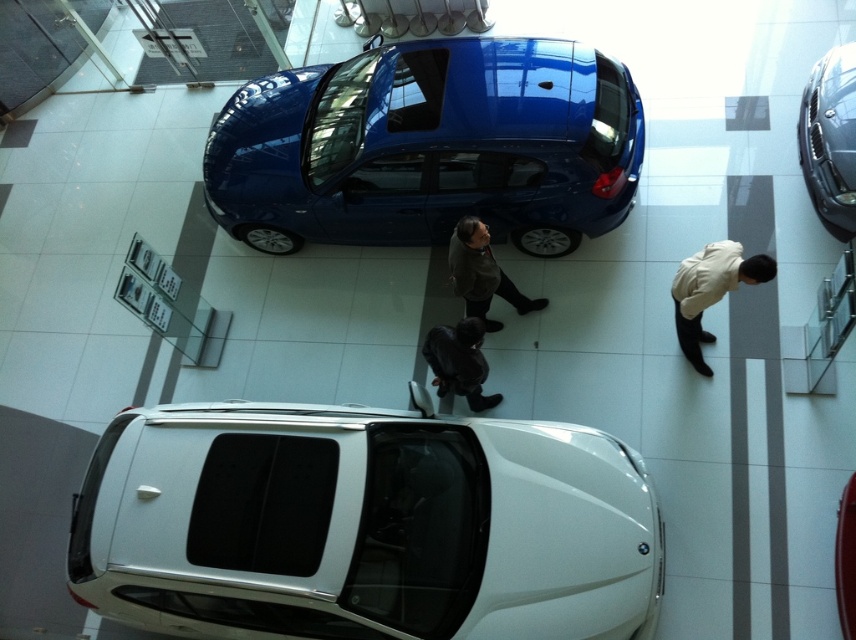
Who is more distant from viewer, (406, 566) or (685, 282)?

The point (685, 282) is behind.

The width and height of the screenshot is (856, 640). Describe the element at coordinates (364, 525) in the screenshot. I see `white glossy suv at lower center` at that location.

Which is in front, point (538, 512) or point (703, 364)?

Point (538, 512) is more forward.

The width and height of the screenshot is (856, 640). Identify the location of white glossy suv at lower center. click(364, 525).

Is white matte jacket at lower right below black leather jacket at center?

No.

Who is positioned more to the left, white matte jacket at lower right or black leather jacket at center?

black leather jacket at center is more to the left.

Where is `white matte jacket at lower right`? The image size is (856, 640). white matte jacket at lower right is located at coordinates (710, 291).

Which is above, glossy blue hatchback at center or white matte jacket at lower right?

glossy blue hatchback at center

Does glossy blue hatchback at center come in front of white matte jacket at lower right?

No, glossy blue hatchback at center is behind white matte jacket at lower right.

Identify the location of glossy blue hatchback at center. point(429,147).